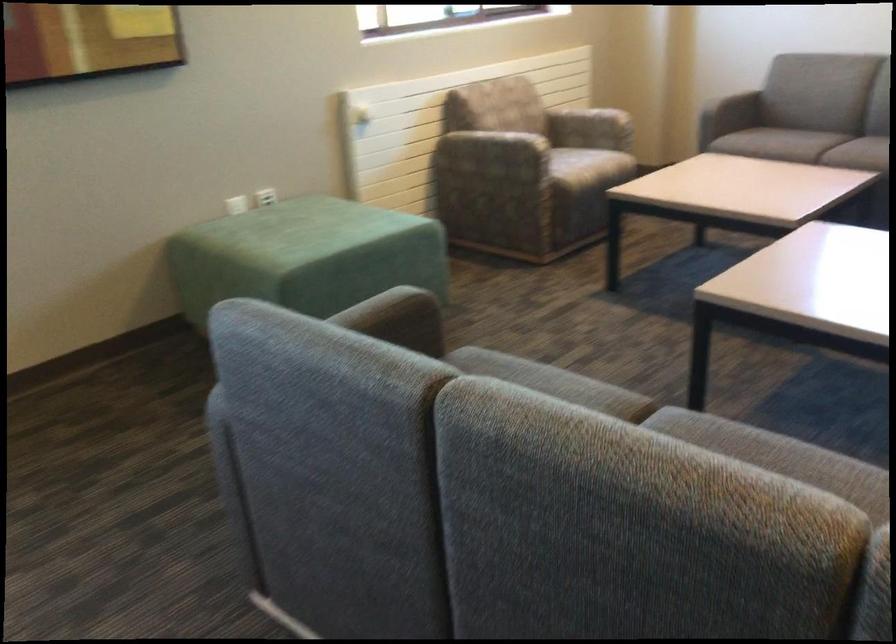
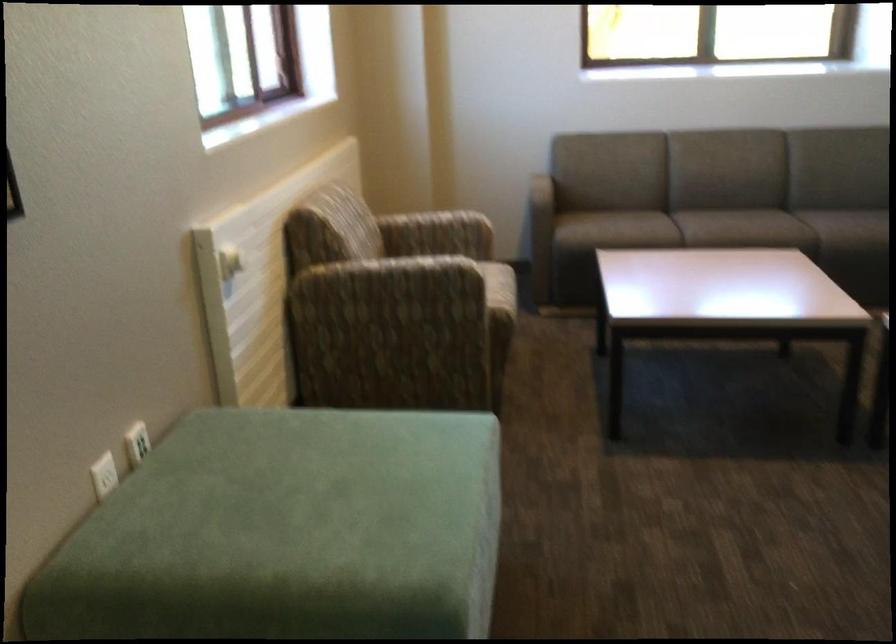
In the second image, find the point that corresponds to point (589, 140) in the first image.

(458, 254)